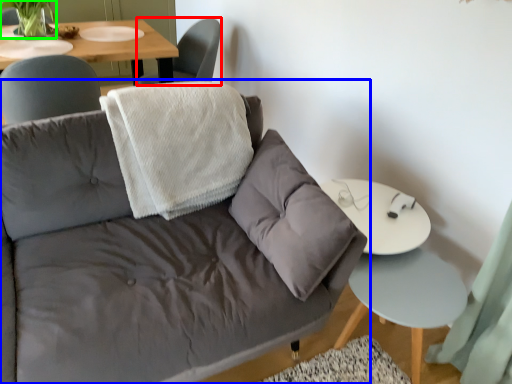
Question: Considering the real-world distances, which object is farthest from chair (highlighted by a red box)? studio couch (highlighted by a blue box) or plant (highlighted by a green box)?

Choices:
 (A) studio couch
 (B) plant

Answer: (A)